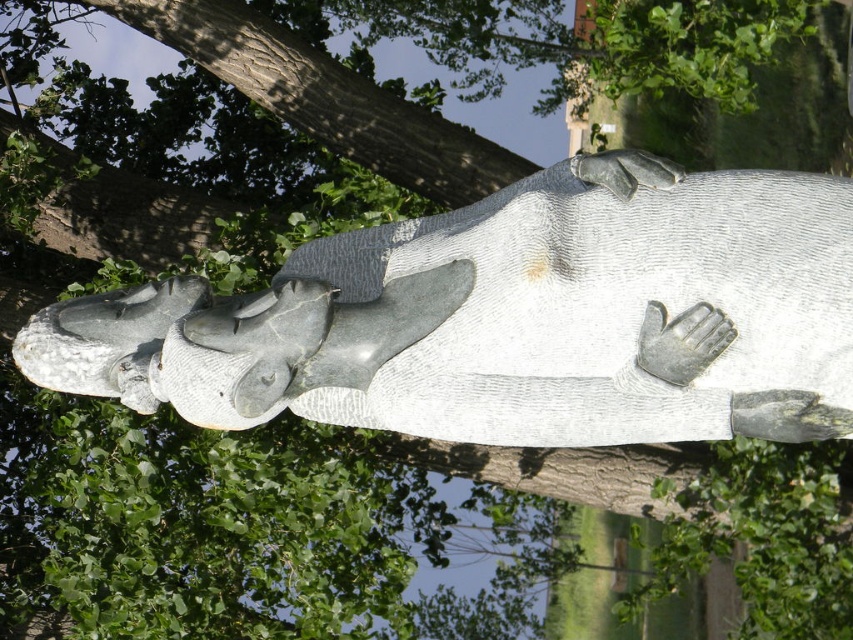
This screenshot has height=640, width=853. Describe the element at coordinates (505, 317) in the screenshot. I see `gray stone statue at center` at that location.

Measure the distance from gray stone statue at center to silver metallic hand at center.

A distance of 5.88 inches exists between gray stone statue at center and silver metallic hand at center.

Does point (695, 273) come closer to viewer compared to point (662, 374)?

Yes.

Find the location of a particular element. This screenshot has width=853, height=640. gray stone statue at center is located at coordinates (505, 317).